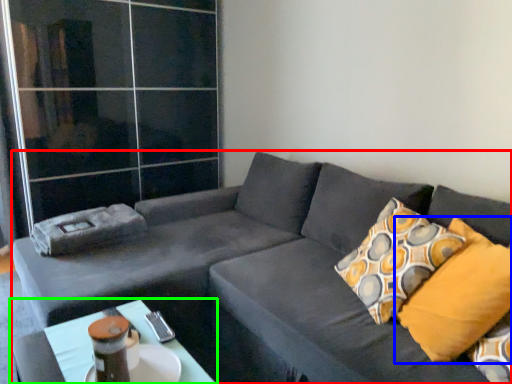
Question: Which object is positioned farthest from studio couch (highlighted by a red box)? Select from pillow (highlighted by a blue box) and table (highlighted by a green box).

Choices:
 (A) pillow
 (B) table

Answer: (B)